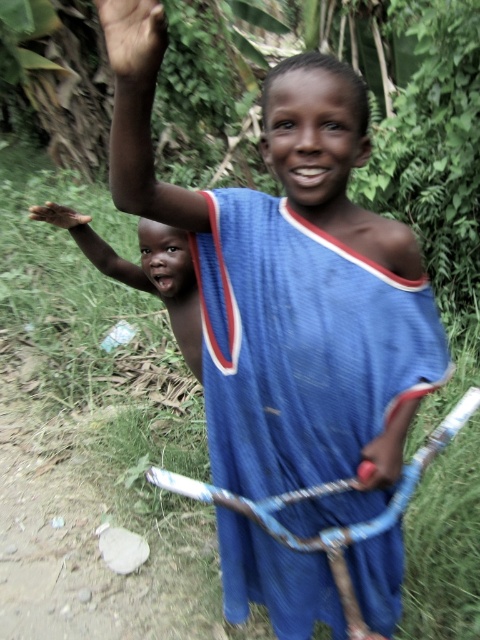
You are standing in a rural area and see two points in the image. Which point is closer to you, point (200, 352) or point (84, 221)?

Point (200, 352) is closer to the viewer than point (84, 221).

You are a photographer trying to capture a clear photo of both the smooth skin child at left and the brown skin hand at upper left. Given their sizes in the photo, which one would you focus on first to ensure clarity?

The smooth skin child at left is larger in size compared to the brown skin hand at upper left, so focusing on the smooth skin child at left first would ensure clarity due to its larger presence in the frame.